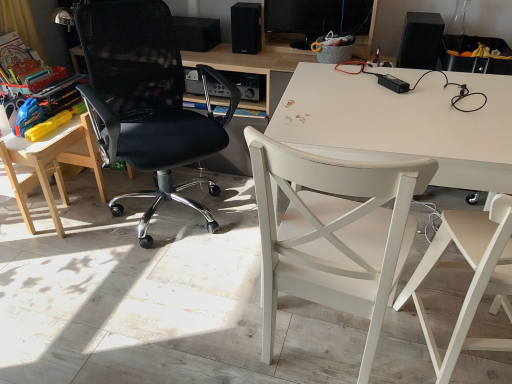
What are the coordinates of `free spot to the left of black mesh office chair at left, positioned as the 3th chair in right-to-left order` in the screenshot? It's located at (66, 240).